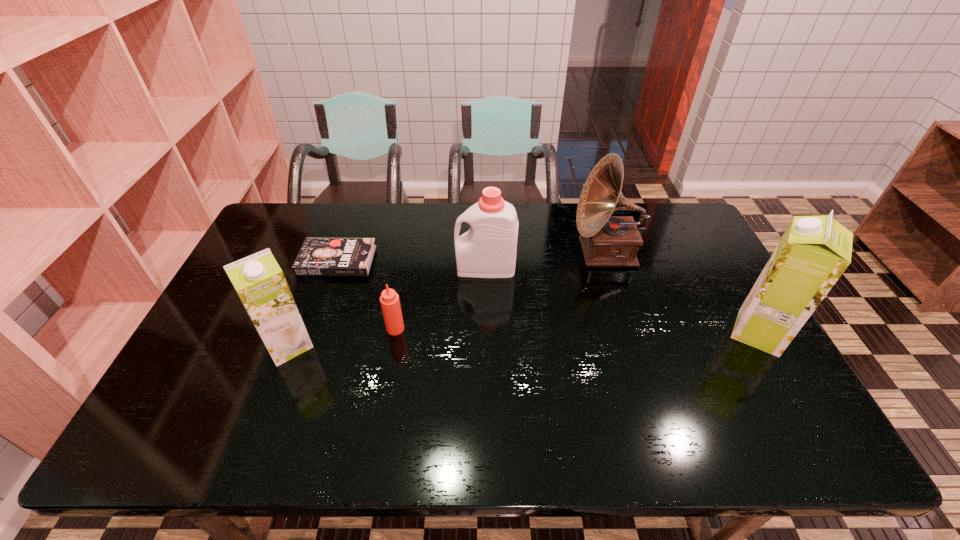
Image resolution: width=960 pixels, height=540 pixels. Find the location of `blank space located on the right of the book`. blank space located on the right of the book is located at coordinates click(388, 260).

At what (x,y) coordinates should I click in order to perform the action: click on vacant area situated 0.110m on the handle side of the third object from right to left. Please return your answer as a coordinate pair (x, y). The width and height of the screenshot is (960, 540). Looking at the image, I should click on (421, 268).

The image size is (960, 540). I want to click on free space located 0.370m on the handle side of the third object from right to left, so click(339, 268).

You are a GUI agent. You are given a task and a screenshot of the screen. Output one action in this format:
    pyautogui.click(x=<x>, y=<y>)
    Task: Click on the free region located 0.180m on the handle side of the third object from right to left
    
    Given the screenshot: What is the action you would take?
    pyautogui.click(x=399, y=268)

Find the location of a particular element. This screenshot has width=960, height=540. free region located 0.260m on the horn of the second object from right to left is located at coordinates (493, 253).

Where is `blank space located on the horn of the second object from right to left`? This screenshot has width=960, height=540. blank space located on the horn of the second object from right to left is located at coordinates pos(512,253).

Locate an element on the screen. This screenshot has width=960, height=540. free location located on the horn of the second object from right to left is located at coordinates (x=460, y=253).

Locate an element on the screen. This screenshot has width=960, height=540. vacant area situated on the back of the fifth tallest object is located at coordinates (409, 254).

Locate an element on the screen. The width and height of the screenshot is (960, 540). object present at the far edge is located at coordinates (607, 241).

Find the location of a particular element. The height and width of the screenshot is (540, 960). object situated at the right edge is located at coordinates (813, 253).